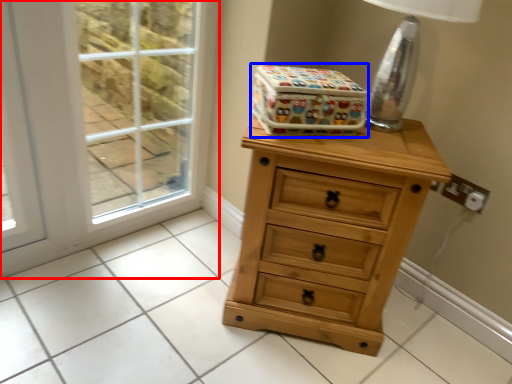
Question: Among these objects, which one is nearest to the camera, screen door (highlighted by a red box) or storage box (highlighted by a blue box)?

Choices:
 (A) screen door
 (B) storage box

Answer: (B)